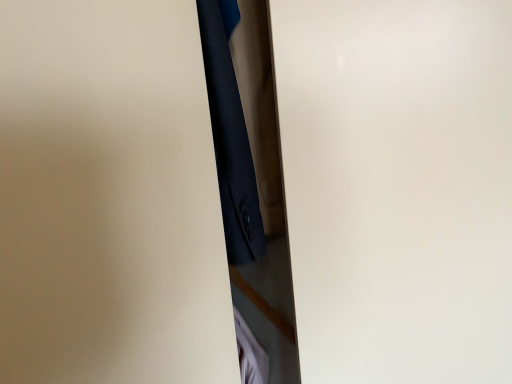
This screenshot has width=512, height=384. Describe the element at coordinates (109, 198) in the screenshot. I see `matte black door at center` at that location.

Locate an element on the screen. The height and width of the screenshot is (384, 512). matte black door at center is located at coordinates (109, 198).

What is the approximate height of matte black door at center?

The height of matte black door at center is 1.02 meters.

In order to click on matte black door at center in this screenshot , I will do `click(109, 198)`.